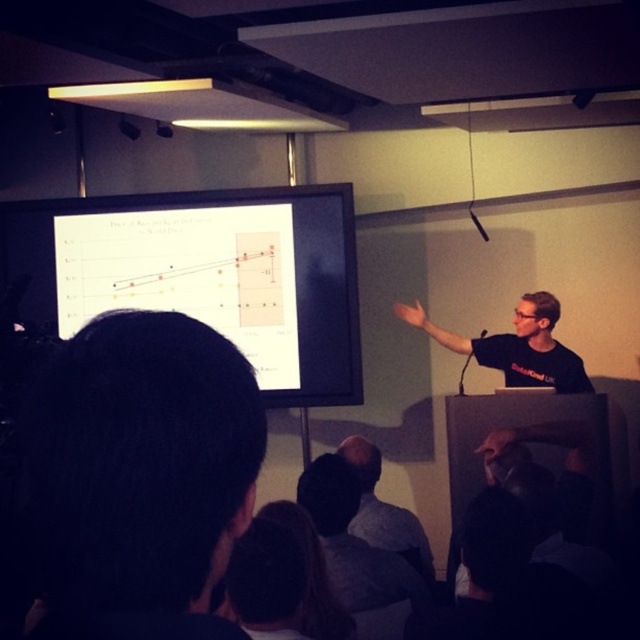
Question: Can you confirm if dark hair at lower left is thinner than white glossy projection screen at upper center?

Choices:
 (A) yes
 (B) no

Answer: (A)

Question: Can you confirm if black matte shirt at center is positioned above gray shirt at center?

Choices:
 (A) no
 (B) yes

Answer: (B)

Question: Which point is farther to the camera?

Choices:
 (A) 385,529
 (B) 406,308
 (C) 38,401
 (D) 340,216

Answer: (D)

Question: Which object is closer to the camera taking this photo?

Choices:
 (A) dark hair at lower left
 (B) gray shirt at center

Answer: (A)

Question: Is dark hair at lower left bigger than black matte shirt at center?

Choices:
 (A) yes
 (B) no

Answer: (B)

Question: Which object is closer to the camera taking this photo?

Choices:
 (A) dark hair at lower left
 (B) white glossy projection screen at upper center
 (C) gray shirt at center
 (D) black matte shirt at center

Answer: (A)